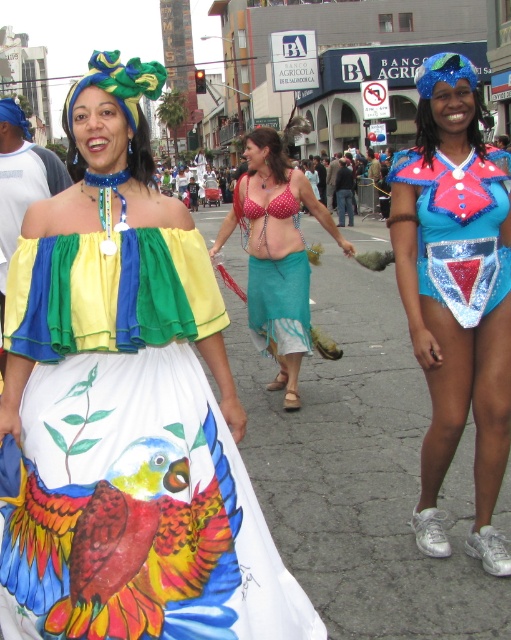
You are a photographer trying to capture the middle woman in the scene. You want to ensure that both the polka dot fabric bikini top at center and the teal fabric skirt at center are clearly visible in your shot. Given their widths, which item should you focus on to ensure it fits within the frame?

The polka dot fabric bikini top at center is narrower than the teal fabric skirt at center, so focusing on the teal fabric skirt at center will ensure it fits within the frame as it is wider.

What object is located at the coordinates point (129, 456)?

The point (129, 456) corresponds to the painted cotton skirt at center.

You are a photographer trying to capture the vibrant street scene. You want to take a photo that includes both the polka dot fabric bikini top at center and the blue sequined top at right. Which of these tops should you focus on first to ensure both are in the frame?

The polka dot fabric bikini top at center is closer to the viewer than the blue sequined top at right, so you should focus on the polka dot fabric bikini top at center first to ensure both are in the frame.